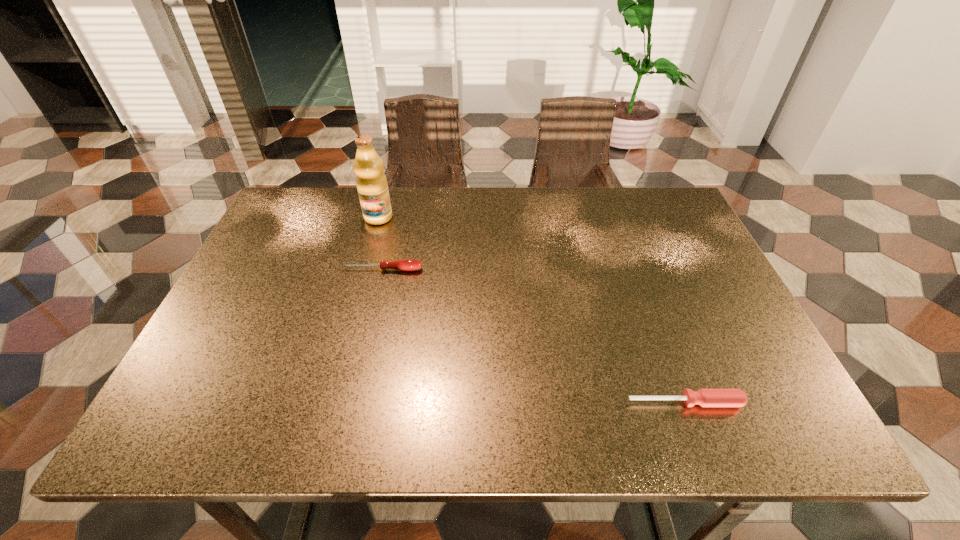
Locate an element on the screen. This screenshot has height=540, width=960. free spot that satisfies the following two spatial constraints: 1. on the front label of the right screwdriver; 2. on the left side of the farthest object is located at coordinates (327, 402).

Identify the location of vacant space that satisfies the following two spatial constraints: 1. on the front label of the farther screwdriver; 2. on the right side of the fruit juice. This screenshot has height=540, width=960. pos(364,269).

This screenshot has height=540, width=960. What are the coordinates of `vacant region that satisfies the following two spatial constraints: 1. on the front label of the fruit juice; 2. on the right side of the farther screwdriver` in the screenshot? It's located at (364, 269).

This screenshot has height=540, width=960. Identify the location of vacant space that satisfies the following two spatial constraints: 1. on the front side of the right screwdriver; 2. on the right side of the left screwdriver. (351, 402).

Image resolution: width=960 pixels, height=540 pixels. I want to click on free location that satisfies the following two spatial constraints: 1. on the front label of the left screwdriver; 2. on the right side of the tallest object, so click(364, 269).

Locate an element on the screen. blank space that satisfies the following two spatial constraints: 1. on the front label of the farther screwdriver; 2. on the left side of the tallest object is located at coordinates (364, 269).

I want to click on free point that satisfies the following two spatial constraints: 1. on the front label of the fruit juice; 2. on the right side of the nearer screwdriver, so click(327, 402).

Locate an element on the screen. vacant space that satisfies the following two spatial constraints: 1. on the front label of the nearer screwdriver; 2. on the right side of the tallest object is located at coordinates (327, 402).

Locate an element on the screen. The height and width of the screenshot is (540, 960). free location that satisfies the following two spatial constraints: 1. on the front side of the second farthest object; 2. on the left side of the nearest object is located at coordinates (351, 402).

Locate an element on the screen. free space in the image that satisfies the following two spatial constraints: 1. on the front side of the left screwdriver; 2. on the left side of the nearer screwdriver is located at coordinates (351, 402).